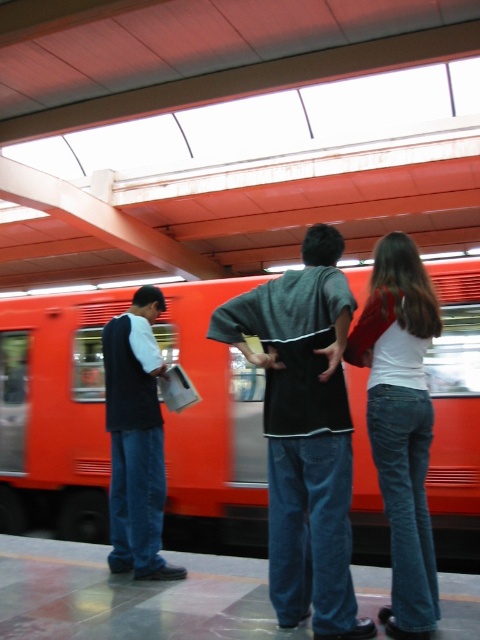
Is white matte shirt at center wider than dark blue jeans at left?

No, white matte shirt at center is not wider than dark blue jeans at left.

Can you confirm if white matte shirt at center is positioned below dark blue jeans at left?

Actually, white matte shirt at center is above dark blue jeans at left.

Who is more distant from viewer, (x=399, y=568) or (x=121, y=330)?

Point (x=121, y=330)

You are a GUI agent. You are given a task and a screenshot of the screen. Output one action in this format:
    pyautogui.click(x=<x>, y=<y>)
    Task: Click on the white matte shirt at center
    The image size is (480, 640).
    Given the screenshot: What is the action you would take?
    pyautogui.click(x=400, y=422)

Does dark gray cotton shirt at center appear on the left side of white matte shirt at center?

Indeed, dark gray cotton shirt at center is positioned on the left side of white matte shirt at center.

Based on the photo, is dark gray cotton shirt at center wider than white matte shirt at center?

Correct, the width of dark gray cotton shirt at center exceeds that of white matte shirt at center.

The width and height of the screenshot is (480, 640). Identify the location of dark gray cotton shirt at center. (304, 433).

The width and height of the screenshot is (480, 640). In order to click on dark gray cotton shirt at center in this screenshot , I will do `click(304, 433)`.

Consider the image. Who is positioned more to the right, orange metallic train at center or dark gray cotton shirt at center?

orange metallic train at center

Does orange metallic train at center have a lesser width compared to dark gray cotton shirt at center?

Yes.

In order to click on orange metallic train at center in this screenshot , I will do 55,412.